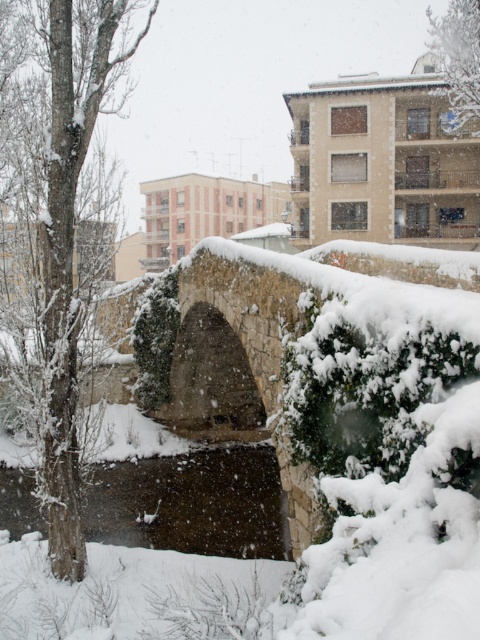
Question: Is snow-covered bark tree at left thinner than green leafy tree at upper center?

Choices:
 (A) yes
 (B) no

Answer: (A)

Question: Which of the following is the closest to the observer?

Choices:
 (A) (458, 3)
 (B) (141, 33)

Answer: (A)

Question: In this image, where is snow-covered bark tree at left located relative to green leafy tree at upper center?

Choices:
 (A) below
 (B) above

Answer: (A)

Question: Which object is closer to the camera taking this photo?

Choices:
 (A) snow-covered bark tree at left
 (B) green leafy tree at upper center

Answer: (A)

Question: Which point is closer to the camera?

Choices:
 (A) snow-covered bark tree at left
 (B) green leafy tree at upper center

Answer: (A)

Question: Is snow-covered bark tree at left thinner than green leafy tree at upper center?

Choices:
 (A) yes
 (B) no

Answer: (A)